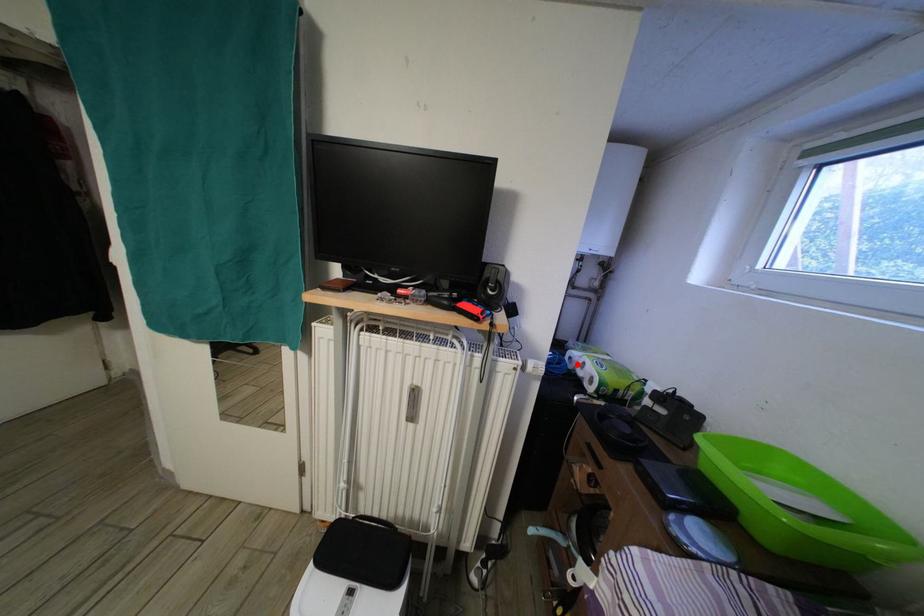
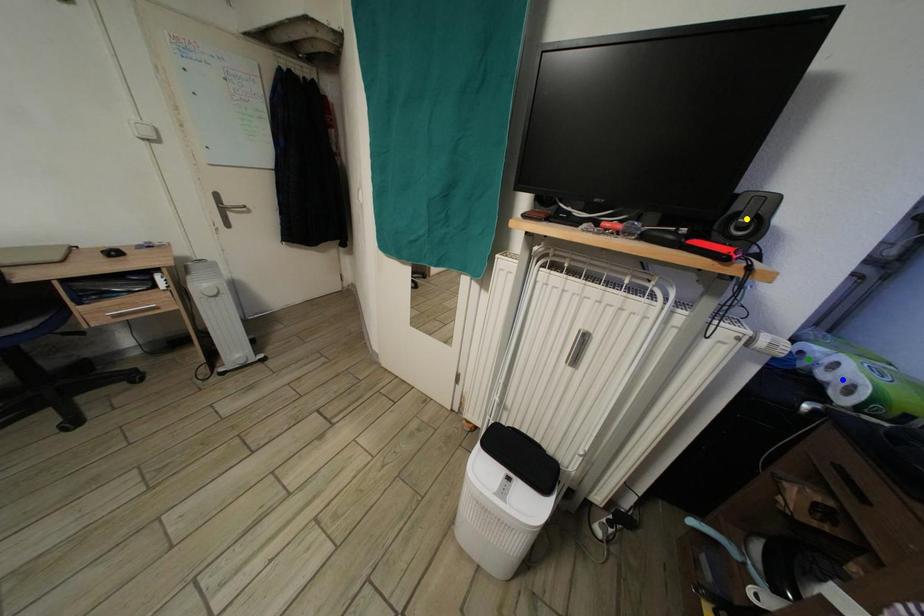
Question: I am providing you with two images of the same scene from different viewpoints. A red point is marked on the first image. You are given multiple points on the second image. In image 2, which mark is for the same physical point as the one in image 1?

Choices:
 (A) blue point
 (B) green point
 (C) yellow point

Answer: (B)